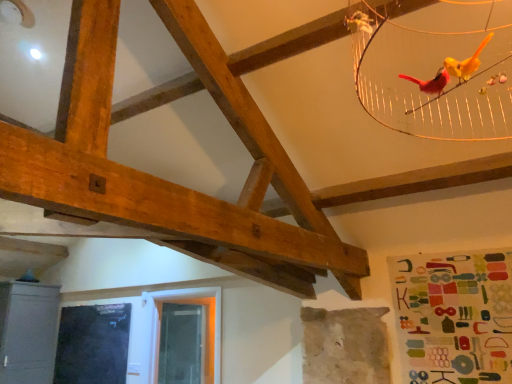
Describe the element at coordinates (93, 344) in the screenshot. I see `black glass window screen at lower left, which is counted as the first window screen, starting from the left` at that location.

Describe the element at coordinates (28, 332) in the screenshot. I see `metallic gray cabinet at lower left` at that location.

This screenshot has width=512, height=384. I want to click on metallic gray cabinet at lower left, so point(28,332).

You are a GUI agent. You are given a task and a screenshot of the screen. Output one action in this format:
    pyautogui.click(x=<x>, y=<y>)
    Task: Click on the black glass window screen at lower left, which is counted as the first window screen, starting from the left
    
    Given the screenshot: What is the action you would take?
    [93, 344]

Is the depth of black glass window screen at lower left, placed as the 2th window screen when sorted from right to left, less than that of metallic gray cabinet at lower left?

Yes, black glass window screen at lower left, placed as the 2th window screen when sorted from right to left, is closer to the camera.

Measure the distance from black glass window screen at lower left, which is counted as the first window screen, starting from the left, to metallic gray cabinet at lower left.

64.37 centimeters.

Can you tell me how much black glass window screen at lower left, placed as the 2th window screen when sorted from right to left, and metallic gray cabinet at lower left differ in facing direction?

There is a 89.8-degree angle between the facing directions of black glass window screen at lower left, placed as the 2th window screen when sorted from right to left, and metallic gray cabinet at lower left.

From the picture: Between black glass window screen at lower left, which is counted as the first window screen, starting from the left, and metallic gray cabinet at lower left, which one appears on the left side from the viewer's perspective?

metallic gray cabinet at lower left.

Which object is positioned more to the right, transparent plastic window screen at lower center, which is the second window screen in left-to-right order, or black glass window screen at lower left, placed as the 2th window screen when sorted from right to left?

A: From the viewer's perspective, transparent plastic window screen at lower center, which is the second window screen in left-to-right order, appears more on the right side.

Would you say transparent plastic window screen at lower center, which is the second window screen in left-to-right order, is outside black glass window screen at lower left, which is counted as the first window screen, starting from the left?

Yes, transparent plastic window screen at lower center, which is the second window screen in left-to-right order, is outside of black glass window screen at lower left, which is counted as the first window screen, starting from the left.

From the image's perspective, between transparent plastic window screen at lower center, the 1th window screen positioned from the right, and black glass window screen at lower left, placed as the 2th window screen when sorted from right to left, who is located below?

transparent plastic window screen at lower center, the 1th window screen positioned from the right.

Is point (160, 345) closer to camera compared to point (89, 363)?

No, (160, 345) is further to viewer.

Is transparent plastic window screen at lower center, which is the second window screen in left-to-right order, next to metallic gray cabinet at lower left and touching it?

They are not placed beside each other.

In terms of height, does transparent plastic window screen at lower center, which is the second window screen in left-to-right order, look taller or shorter compared to metallic gray cabinet at lower left?

In the image, transparent plastic window screen at lower center, which is the second window screen in left-to-right order, appears to be shorter than metallic gray cabinet at lower left.

Visually, is transparent plastic window screen at lower center, the 1th window screen positioned from the right, positioned to the left or to the right of metallic gray cabinet at lower left?

Clearly, transparent plastic window screen at lower center, the 1th window screen positioned from the right, is on the right of metallic gray cabinet at lower left in the image.

From a real-world perspective, relative to metallic gray cabinet at lower left, is transparent plastic window screen at lower center, which is the second window screen in left-to-right order, vertically above or below?

Clearly, from a real-world perspective, transparent plastic window screen at lower center, which is the second window screen in left-to-right order, is below metallic gray cabinet at lower left.

From the image's perspective, is metallic gray cabinet at lower left above transparent plastic window screen at lower center, which is the second window screen in left-to-right order?

Indeed, from the image's perspective, metallic gray cabinet at lower left is shown above transparent plastic window screen at lower center, which is the second window screen in left-to-right order.

Is metallic gray cabinet at lower left oriented away from transparent plastic window screen at lower center, which is the second window screen in left-to-right order?

metallic gray cabinet at lower left is not turned away from transparent plastic window screen at lower center, which is the second window screen in left-to-right order.

How distant is black glass window screen at lower left, which is counted as the first window screen, starting from the left, from transparent plastic window screen at lower center, the 1th window screen positioned from the right?

They are 26.62 inches apart.

Considering the sizes of objects black glass window screen at lower left, placed as the 2th window screen when sorted from right to left, and transparent plastic window screen at lower center, which is the second window screen in left-to-right order, in the image provided, who is bigger, black glass window screen at lower left, placed as the 2th window screen when sorted from right to left, or transparent plastic window screen at lower center, which is the second window screen in left-to-right order,?

transparent plastic window screen at lower center, which is the second window screen in left-to-right order, is bigger.

From a real-world perspective, is black glass window screen at lower left, which is counted as the first window screen, starting from the left, under transparent plastic window screen at lower center, which is the second window screen in left-to-right order?

Yes, from a real-world perspective, black glass window screen at lower left, which is counted as the first window screen, starting from the left, is below transparent plastic window screen at lower center, which is the second window screen in left-to-right order.

Is black glass window screen at lower left, placed as the 2th window screen when sorted from right to left, in front of or behind transparent plastic window screen at lower center, which is the second window screen in left-to-right order, in the image?

Clearly, black glass window screen at lower left, placed as the 2th window screen when sorted from right to left, is in front of transparent plastic window screen at lower center, which is the second window screen in left-to-right order.

Does point (10, 315) lie behind point (72, 359)?

That is False.

From the picture: Which object is positioned more to the right, metallic gray cabinet at lower left or black glass window screen at lower left, placed as the 2th window screen when sorted from right to left?

From the viewer's perspective, black glass window screen at lower left, placed as the 2th window screen when sorted from right to left, appears more on the right side.

Can black glass window screen at lower left, placed as the 2th window screen when sorted from right to left, be found inside metallic gray cabinet at lower left?

No.

Find the location of a particular element. Image resolution: width=512 pixels, height=384 pixels. furniture on the left of the black glass window screen at lower left, placed as the 2th window screen when sorted from right to left is located at coordinates (28, 332).

The height and width of the screenshot is (384, 512). I want to click on the 2nd window screen directly beneath the metallic gray cabinet at lower left (from a real-world perspective), so click(x=93, y=344).

The height and width of the screenshot is (384, 512). I want to click on window screen lying below the black glass window screen at lower left, placed as the 2th window screen when sorted from right to left (from the image's perspective), so click(180, 344).

Based on their spatial positions, is black glass window screen at lower left, which is counted as the first window screen, starting from the left, or metallic gray cabinet at lower left closer to transparent plastic window screen at lower center, the 1th window screen positioned from the right?

The object closer to transparent plastic window screen at lower center, the 1th window screen positioned from the right, is black glass window screen at lower left, which is counted as the first window screen, starting from the left.

When comparing their distances from black glass window screen at lower left, placed as the 2th window screen when sorted from right to left, does transparent plastic window screen at lower center, the 1th window screen positioned from the right, or metallic gray cabinet at lower left seem closer?

Based on the image, metallic gray cabinet at lower left appears to be nearer to black glass window screen at lower left, placed as the 2th window screen when sorted from right to left.

Which object lies further to the anchor point metallic gray cabinet at lower left, transparent plastic window screen at lower center, the 1th window screen positioned from the right, or black glass window screen at lower left, which is counted as the first window screen, starting from the left?

transparent plastic window screen at lower center, the 1th window screen positioned from the right, lies further to metallic gray cabinet at lower left than the other object.

Based on their spatial positions, is metallic gray cabinet at lower left or transparent plastic window screen at lower center, the 1th window screen positioned from the right, closer to black glass window screen at lower left, which is counted as the first window screen, starting from the left?

The object closer to black glass window screen at lower left, which is counted as the first window screen, starting from the left, is metallic gray cabinet at lower left.

Based on their spatial positions, is black glass window screen at lower left, placed as the 2th window screen when sorted from right to left, or transparent plastic window screen at lower center, which is the second window screen in left-to-right order, further from metallic gray cabinet at lower left?

The object further to metallic gray cabinet at lower left is transparent plastic window screen at lower center, which is the second window screen in left-to-right order.

Considering their positions, is metallic gray cabinet at lower left positioned further to transparent plastic window screen at lower center, which is the second window screen in left-to-right order, than black glass window screen at lower left, placed as the 2th window screen when sorted from right to left?

metallic gray cabinet at lower left is further to transparent plastic window screen at lower center, which is the second window screen in left-to-right order.

Identify the location of window screen between metallic gray cabinet at lower left and transparent plastic window screen at lower center, the 1th window screen positioned from the right, from left to right. The width and height of the screenshot is (512, 384). (93, 344).